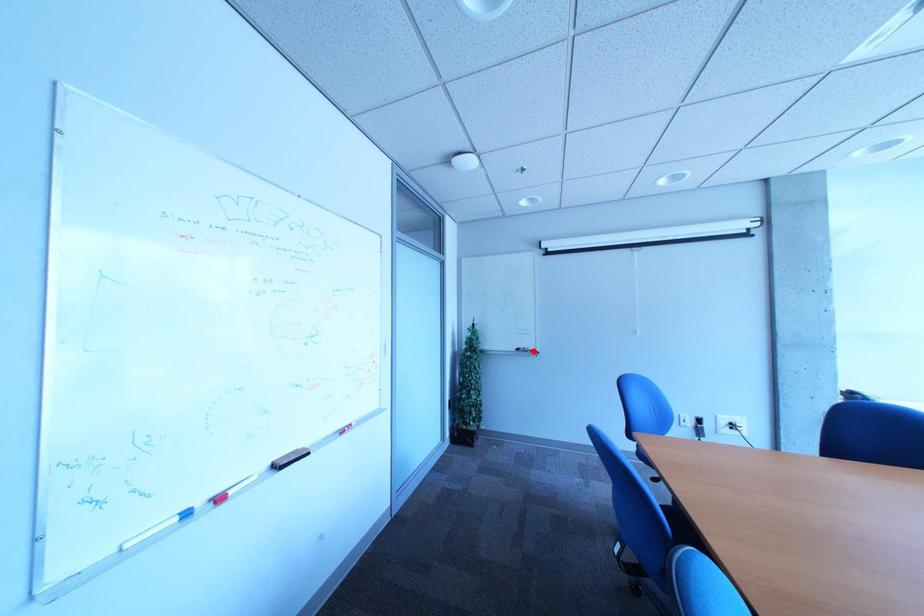
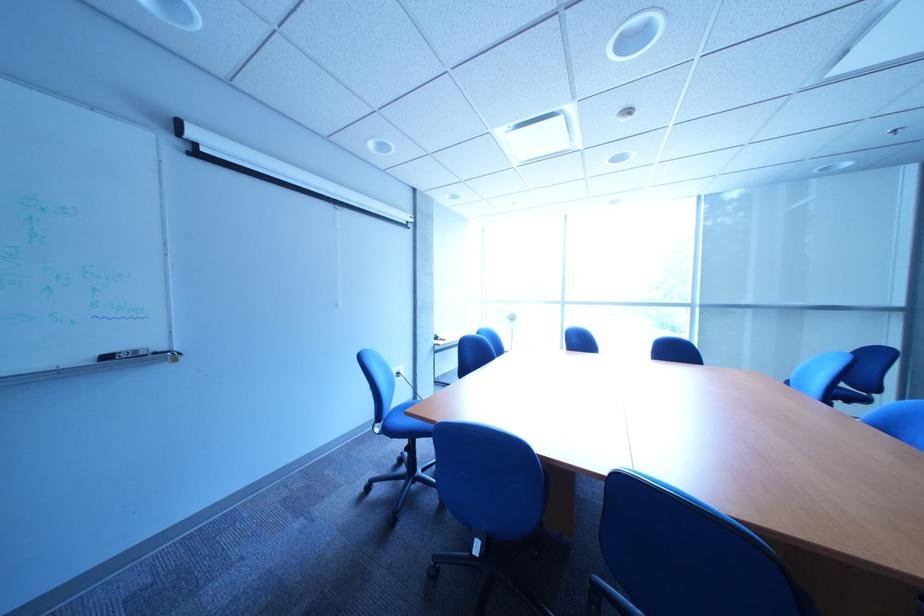
Locate, in the second image, the point that corresponds to the highlighted location in the first image.

(123, 359)